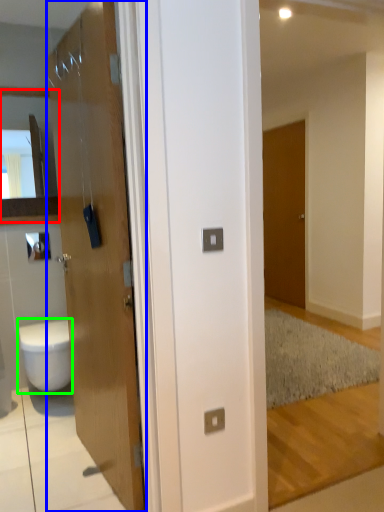
Question: Which object is positioned farthest from cabinet (highlighted by a red box)? Select from door (highlighted by a blue box) and bidet (highlighted by a green box).

Choices:
 (A) door
 (B) bidet

Answer: (A)